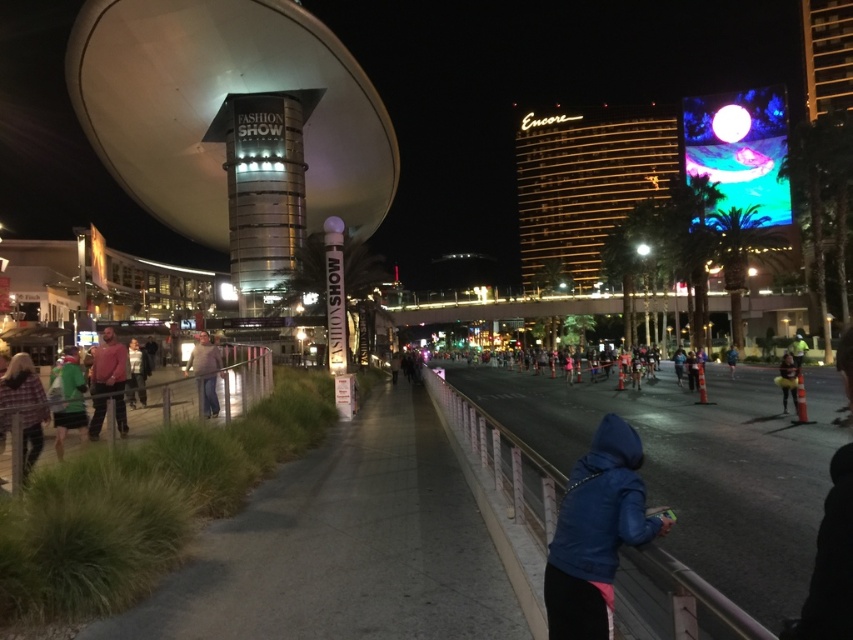
Question: Is plaid shirt at lower left behind matte pink sweater at center-left?

Choices:
 (A) no
 (B) yes

Answer: (A)

Question: Which of the following is the farthest from the observer?

Choices:
 (A) (186, 365)
 (B) (569, 618)
 (C) (730, 365)

Answer: (C)

Question: Where is light brown leather jacket at center located in relation to blue fabric jacket at center-right in the image?

Choices:
 (A) above
 (B) below

Answer: (A)

Question: Which point is closer to the camera?

Choices:
 (A) blue matte jacket at lower right
 (B) yellow reflective vest at center
 (C) green fabric shirt at left

Answer: (A)

Question: Which point is farther to the camera?

Choices:
 (A) (733, 369)
 (B) (206, 400)
 (C) (62, 400)
 (D) (103, 385)

Answer: (A)

Question: Does matte pink sweater at center-left have a lesser width compared to striped sweater at left?

Choices:
 (A) yes
 (B) no

Answer: (A)